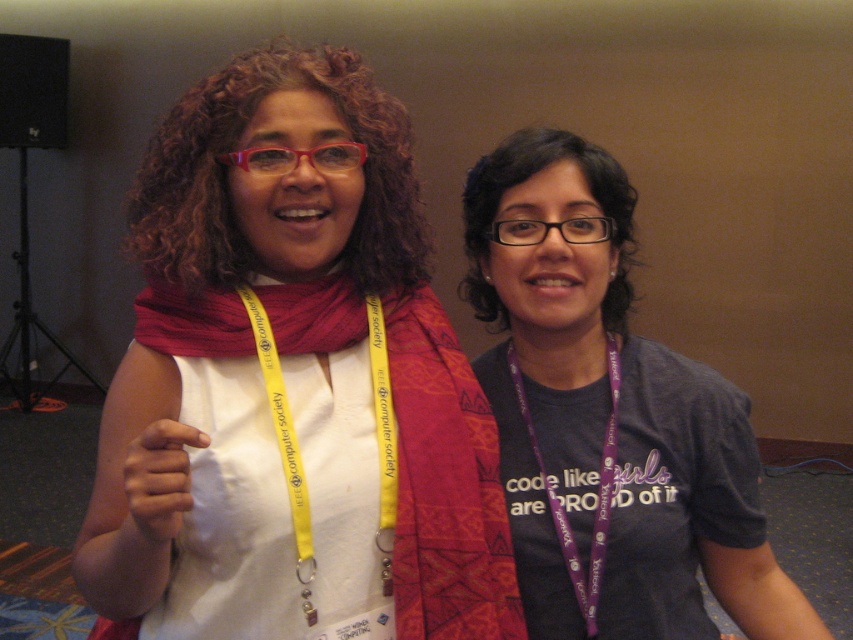
You are an event organizer who needs to check if the purple lanyard at center and the matte red scarf at center are positioned correctly for a photo shoot. According to the spatial arrangement, which object is closer to the camera?

The purple lanyard at center is further to the viewer than the matte red scarf at center, so the purple lanyard at center is closer to the camera.